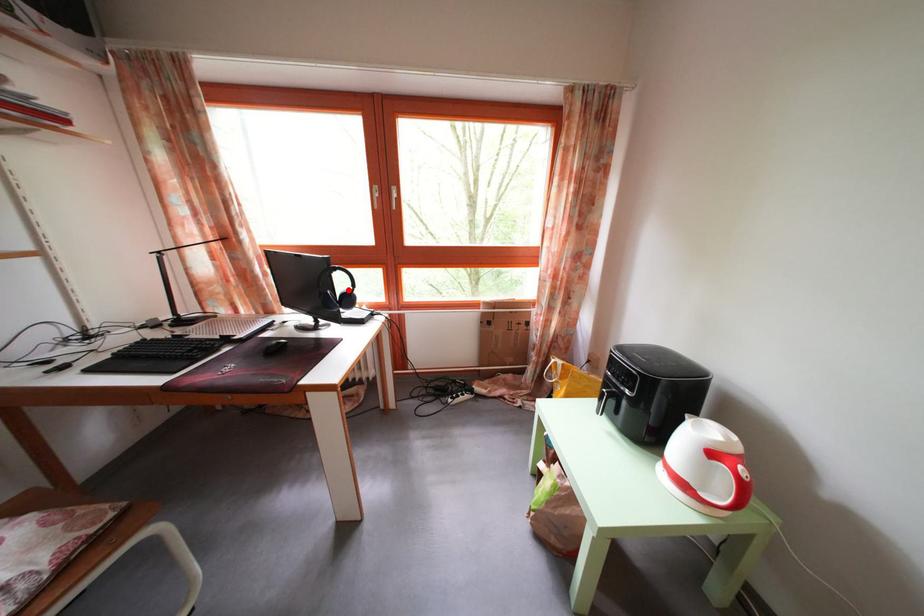
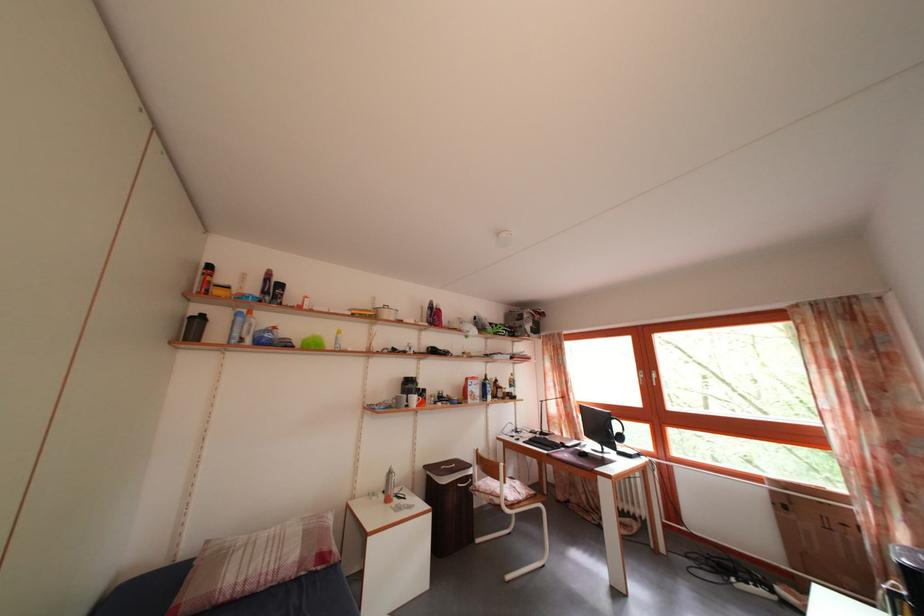
In the second image, find the point that corresponds to the highlighted location in the first image.

(624, 434)